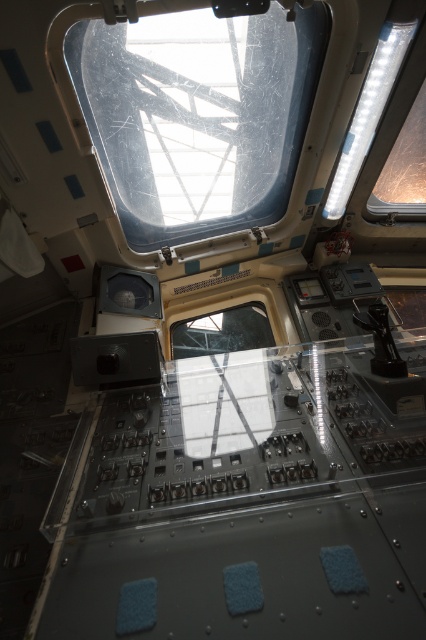
You are an astronaut inside the spacecraft. You notice two points marked on the control panel. The first point is at coordinates point (x=247, y=56) and the second is at point (x=362, y=138). Which point is closer to you?

Point (x=247, y=56) is closer to the camera than point (x=362, y=138).

You are an astronaut preparing for a mission and need to check the status of the transparent plastic window at upper center and the transparent glass window at upper right. Which window has a greater width?

The transparent plastic window at upper center has a greater width than the transparent glass window at upper right.

You are an astronaut preparing for a mission and need to monitor the outside environment through the windows. Which window, the transparent plastic window at upper center or the transparent glass window at upper right, should you choose if you want a wider field of view?

The transparent plastic window at upper center is bigger than the transparent glass window at upper right, so you should choose the transparent plastic window at upper center for a wider field of view.